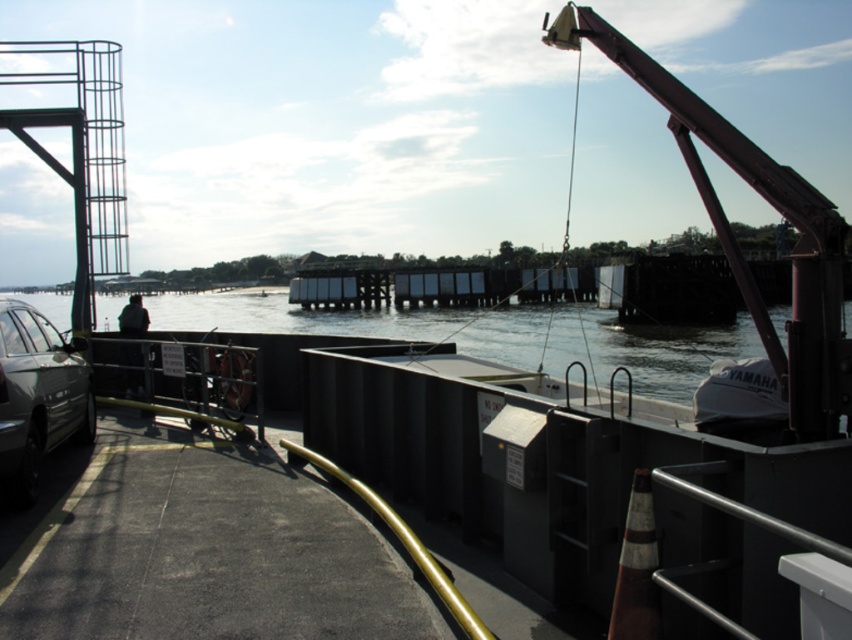
You are standing on the ferry deck and want to jump into the water. The safety rule says you must be at least 15 feet away from the edge to jump safely. Are you within the safe distance if you jump from where the clear water at center is located?

The clear water at center is 14.79 feet away from viewer. Since 14.79 feet is less than the required 15 feet, jumping from there would be unsafe as it is too close to the edge.